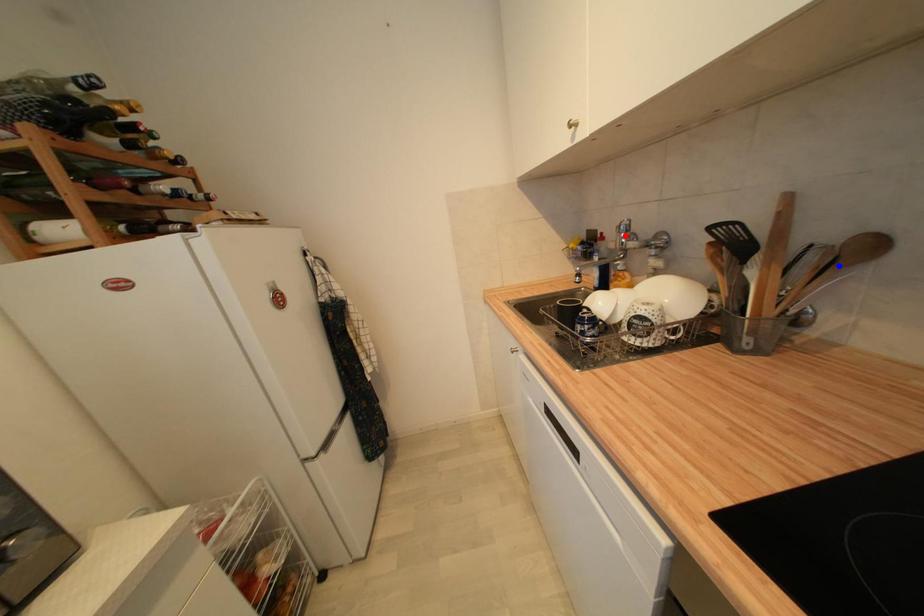
Question: Which of the two points in the image is closer to the camera?

Choices:
 (A) Blue point is closer.
 (B) Red point is closer.

Answer: (A)